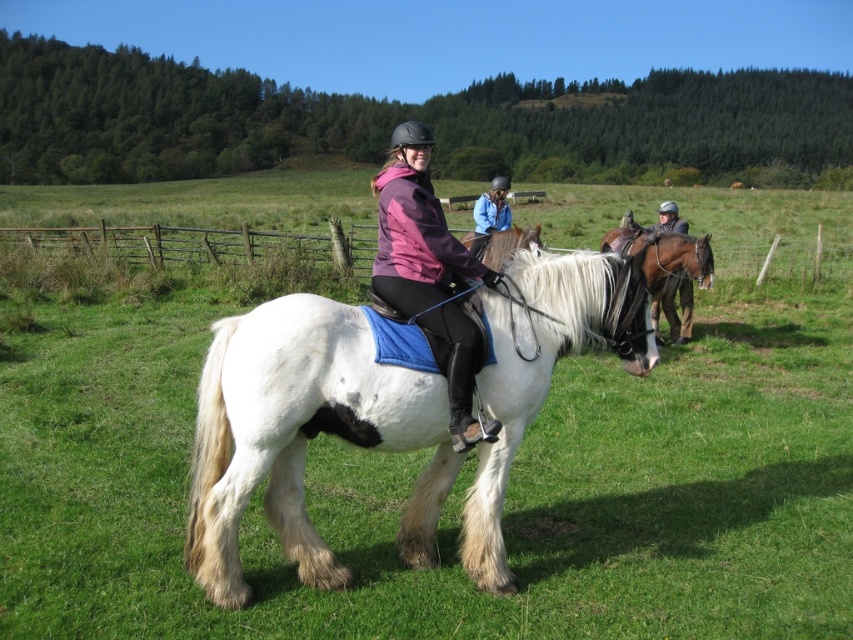
Question: Is dark brown leather jacket at center positioned before white shaggy horse at center?

Choices:
 (A) no
 (B) yes

Answer: (A)

Question: Which of the following is the farthest from the observer?

Choices:
 (A) brown glossy horse at center
 (B) white soft fur horse at center

Answer: (A)

Question: Can you confirm if brown glossy horse at center is positioned to the left of white shaggy horse at center?

Choices:
 (A) yes
 (B) no

Answer: (B)

Question: Is green grassy field at center positioned in front of white soft fur horse at center?

Choices:
 (A) no
 (B) yes

Answer: (A)

Question: Estimate the real-world distances between objects in this image. Which object is farther from the dark brown leather jacket at center?

Choices:
 (A) green grassy field at center
 (B) white soft fur horse at center
 (C) purple fleece jacket at center

Answer: (A)

Question: Which of the following is the closest to the observer?

Choices:
 (A) white shaggy horse at center
 (B) green grassy field at center
 (C) blue matte jacket at center

Answer: (B)